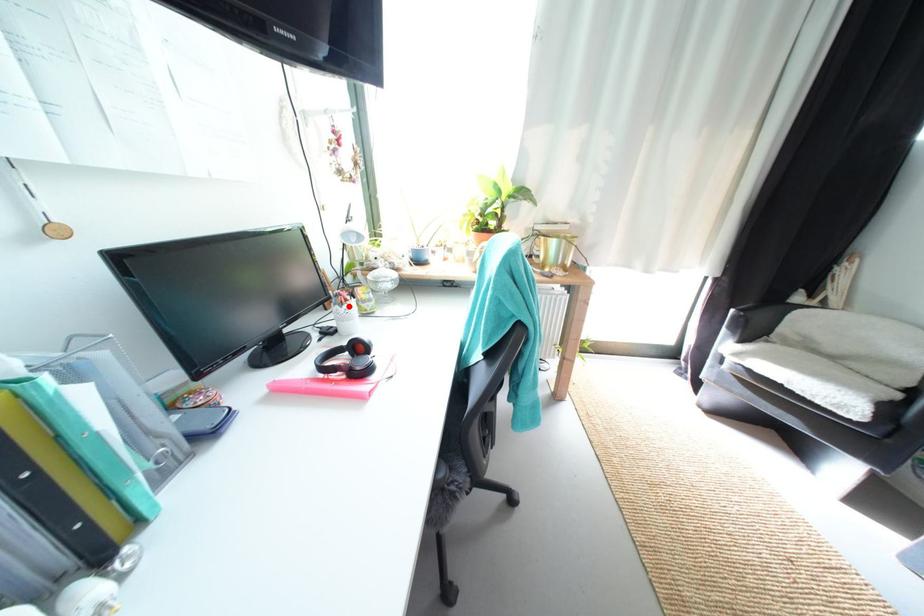
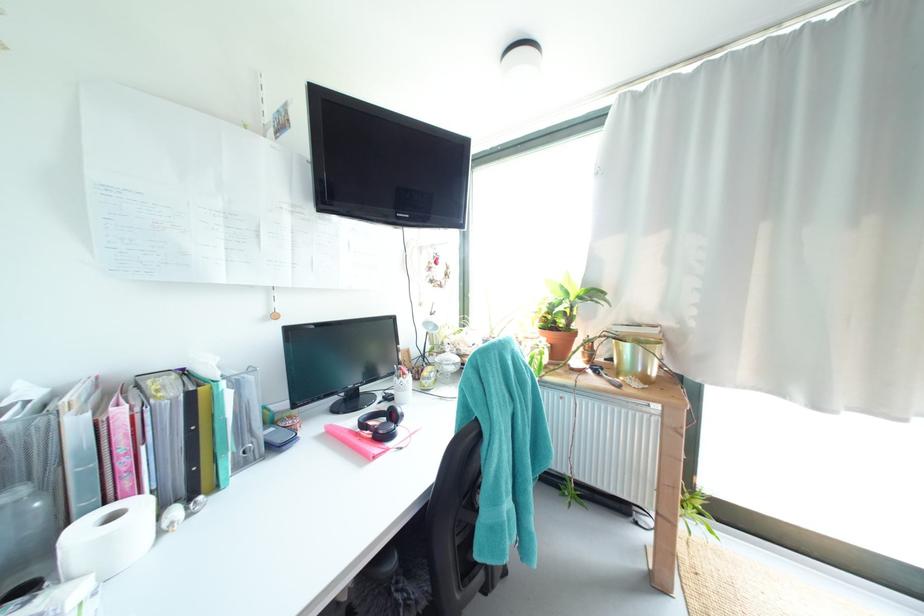
In the second image, find the point that corresponds to the highlighted location in the first image.

(407, 379)